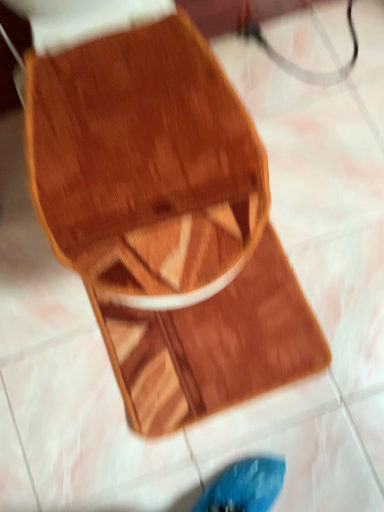
Question: Does wooden shoe at center appear on the right side of wooden cutting board at center?

Choices:
 (A) yes
 (B) no

Answer: (A)

Question: Considering the relative sizes of wooden shoe at center and wooden cutting board at center in the image provided, is wooden shoe at center shorter than wooden cutting board at center?

Choices:
 (A) no
 (B) yes

Answer: (A)

Question: Does wooden shoe at center have a greater height compared to wooden cutting board at center?

Choices:
 (A) no
 (B) yes

Answer: (B)

Question: Is wooden cutting board at center a part of wooden shoe at center?

Choices:
 (A) yes
 (B) no

Answer: (A)

Question: Is wooden shoe at center looking in the opposite direction of wooden cutting board at center?

Choices:
 (A) yes
 (B) no

Answer: (A)

Question: From the image's perspective, is wooden shoe at center over wooden cutting board at center?

Choices:
 (A) no
 (B) yes

Answer: (B)

Question: Would you say wooden shoe at center is part of wooden cutting board at center's contents?

Choices:
 (A) no
 (B) yes

Answer: (A)

Question: Does wooden cutting board at center appear on the left side of wooden shoe at center?

Choices:
 (A) yes
 (B) no

Answer: (A)

Question: Can we say wooden cutting board at center lies outside wooden shoe at center?

Choices:
 (A) no
 (B) yes

Answer: (A)

Question: Is the position of wooden cutting board at center more distant than that of wooden shoe at center?

Choices:
 (A) yes
 (B) no

Answer: (A)

Question: Considering the relative sizes of wooden cutting board at center and wooden shoe at center in the image provided, is wooden cutting board at center wider than wooden shoe at center?

Choices:
 (A) no
 (B) yes

Answer: (A)

Question: Could you tell me if wooden cutting board at center is facing wooden shoe at center?

Choices:
 (A) no
 (B) yes

Answer: (B)

Question: From the image's perspective, is wooden shoe at center above or below wooden cutting board at center?

Choices:
 (A) below
 (B) above

Answer: (B)